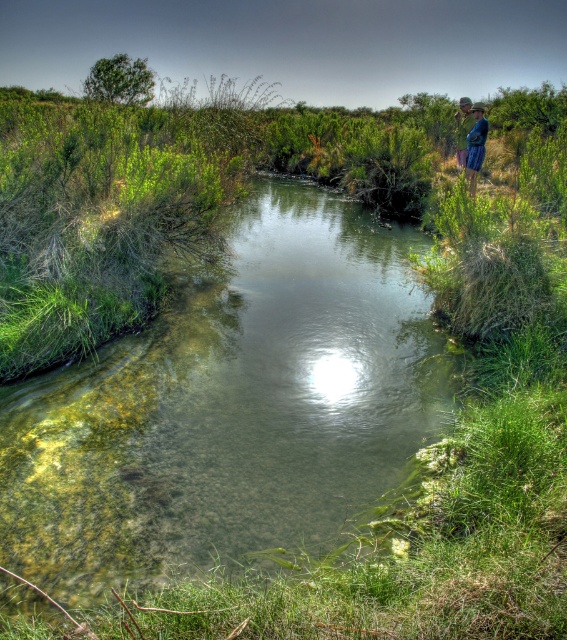
Question: Where is clear water at upper center located in relation to blue denim shorts at upper right in the image?

Choices:
 (A) left
 (B) right

Answer: (A)

Question: Which object appears farthest from the camera in this image?

Choices:
 (A) blue denim shorts at upper right
 (B) blue denim jeans at upper right

Answer: (B)

Question: Does blue denim shorts at upper right have a lesser width compared to blue denim jeans at upper right?

Choices:
 (A) yes
 (B) no

Answer: (B)

Question: Which object appears closest to the camera in this image?

Choices:
 (A) clear water at upper center
 (B) blue denim jeans at upper right

Answer: (A)

Question: Among these objects, which one is nearest to the camera?

Choices:
 (A) clear water at upper center
 (B) blue denim jeans at upper right
 (C) blue denim shorts at upper right

Answer: (A)

Question: Does clear water at upper center lie in front of blue denim jeans at upper right?

Choices:
 (A) no
 (B) yes

Answer: (B)